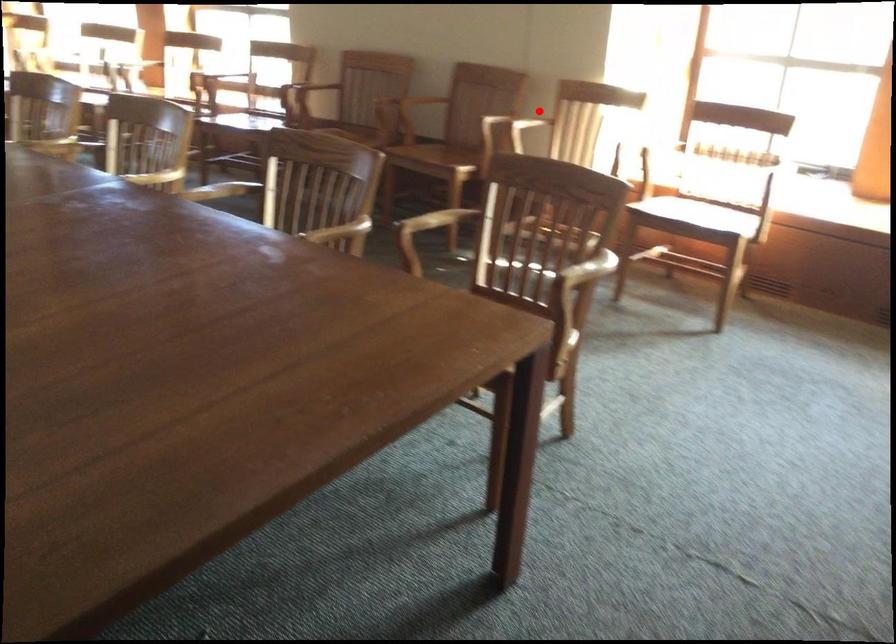
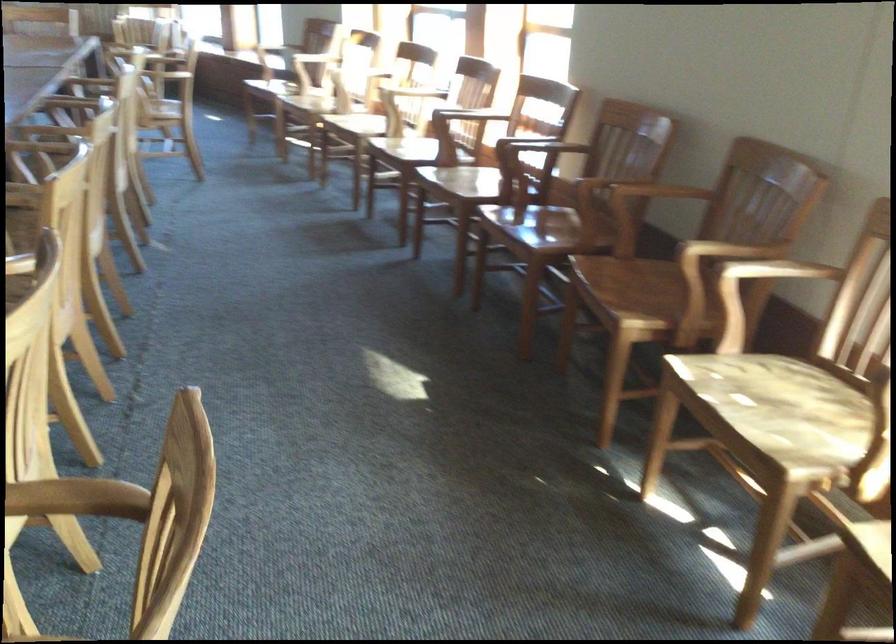
Question: I am providing you with two images of the same scene from different viewpoints. Given a red point in image1, look at the same physical point in image2. Is it:

Choices:
 (A) Closer to the viewpoint
 (B) Farther from the viewpoint

Answer: (A)